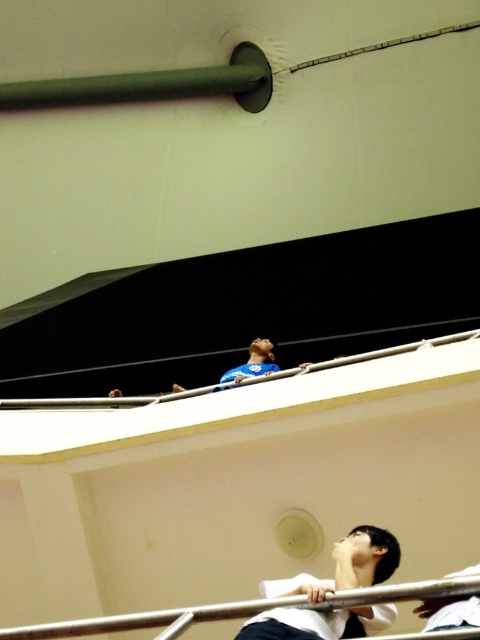
Question: Is green matte pole at upper left above black matte shirt at lower center?

Choices:
 (A) no
 (B) yes

Answer: (B)

Question: Is green matte pole at upper left positioned behind black matte shirt at lower center?

Choices:
 (A) yes
 (B) no

Answer: (A)

Question: Which of the following is the closest to the observer?

Choices:
 (A) (347, 573)
 (B) (35, 99)

Answer: (A)

Question: Is green matte pole at upper left to the right of black matte shirt at lower center from the viewer's perspective?

Choices:
 (A) yes
 (B) no

Answer: (B)

Question: Among these points, which one is nearest to the camera?

Choices:
 (A) (384, 618)
 (B) (76, 83)

Answer: (A)

Question: Among these objects, which one is nearest to the camera?

Choices:
 (A) green matte pole at upper left
 (B) black matte shirt at lower center

Answer: (B)